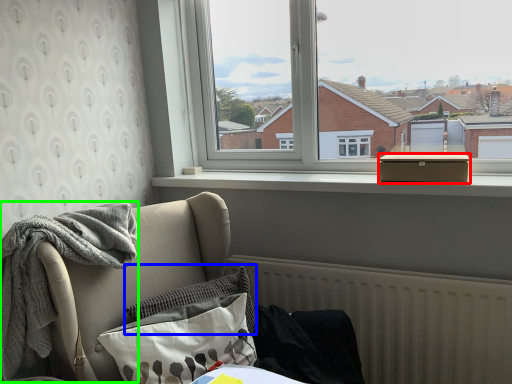
Question: Estimate the real-world distances between objects in this image. Which object is closer to box (highlighted by a red box), pillow (highlighted by a blue box) or material (highlighted by a green box)?

Choices:
 (A) pillow
 (B) material

Answer: (A)